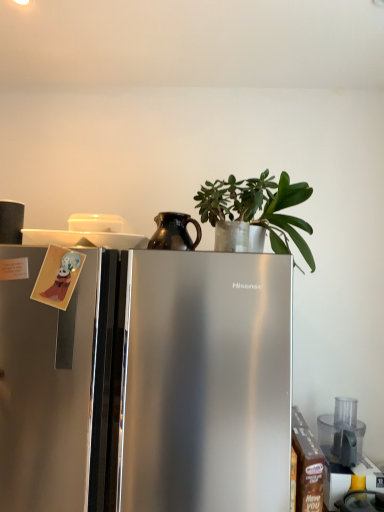
You are a GUI agent. You are given a task and a screenshot of the screen. Output one action in this format:
    pyautogui.click(x=<x>, y=<y>)
    Task: Click on the free region under transparent plastic food processor at lower right, marked as the third appliance in a top-to-bottom arrangement (from a real-world perspective)
    
    Given the screenshot: What is the action you would take?
    pyautogui.click(x=354, y=460)